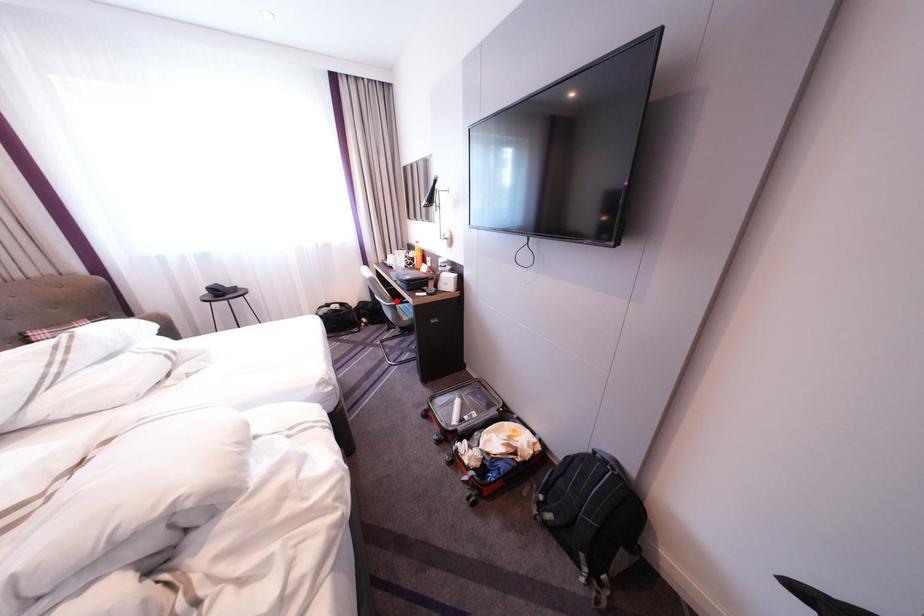
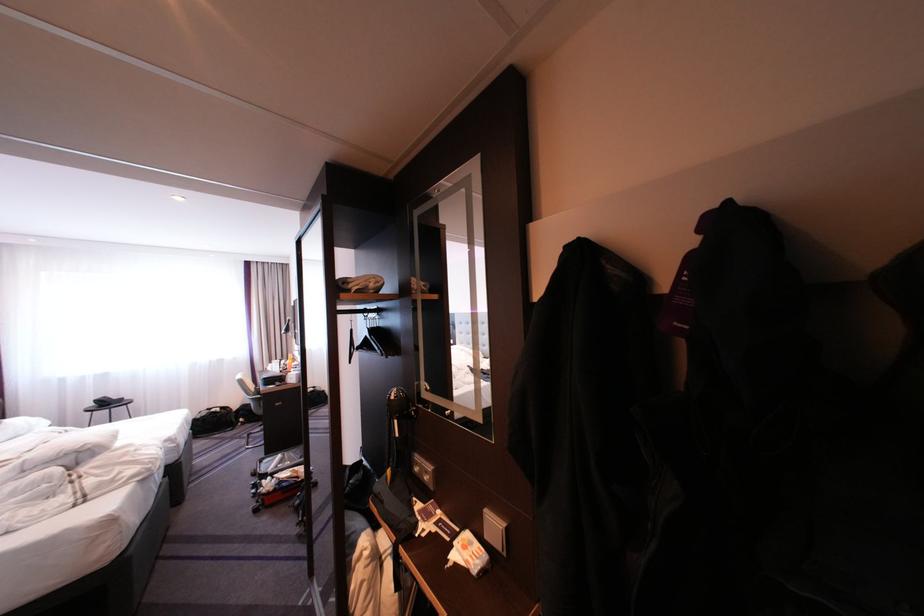
In the second image, find the point that corresponds to the highlighted location in the first image.

(261, 395)